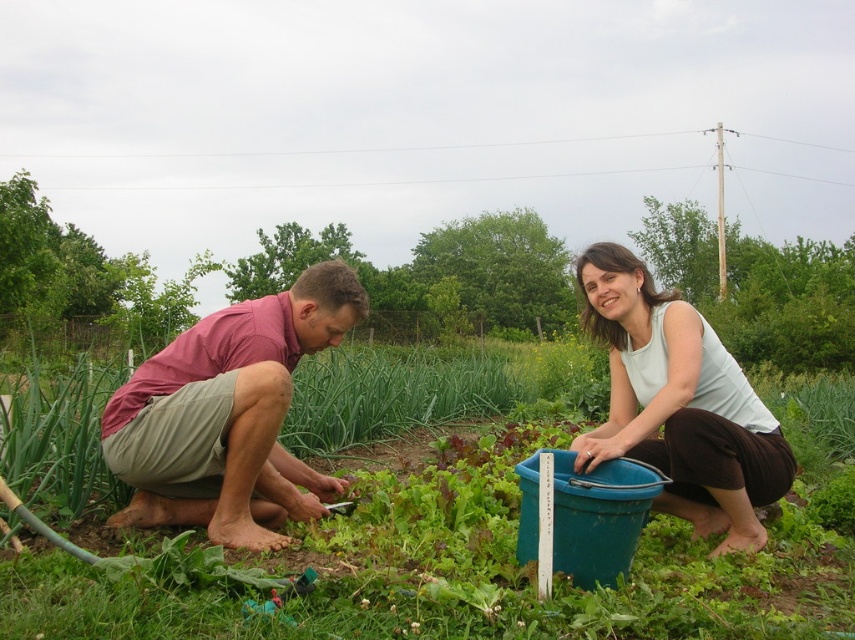
Who is lower down, green leafy vegetables at center or pink textured shirt at center?

pink textured shirt at center is below.

Who is positioned more to the right, green leafy vegetables at center or pink textured shirt at center?

green leafy vegetables at center is more to the right.

Locate an element on the screen. This screenshot has height=640, width=855. green leafy vegetables at center is located at coordinates (457, 525).

Which is above, green leafy vegetables at center or white matte tank top at center?

green leafy vegetables at center

Based on the photo, does green leafy vegetables at center appear on the right side of white matte tank top at center?

In fact, green leafy vegetables at center is to the left of white matte tank top at center.

Is point (308, 554) closer to viewer compared to point (696, 406)?

That is True.

The image size is (855, 640). I want to click on green leafy vegetables at center, so click(457, 525).

Between pink textured shirt at center and white matte tank top at center, which one appears on the left side from the viewer's perspective?

From the viewer's perspective, pink textured shirt at center appears more on the left side.

Is pink textured shirt at center taller than white matte tank top at center?

No, pink textured shirt at center is not taller than white matte tank top at center.

Describe the element at coordinates (228, 416) in the screenshot. This screenshot has width=855, height=640. I see `pink textured shirt at center` at that location.

Identify the location of pink textured shirt at center. The image size is (855, 640). (228, 416).